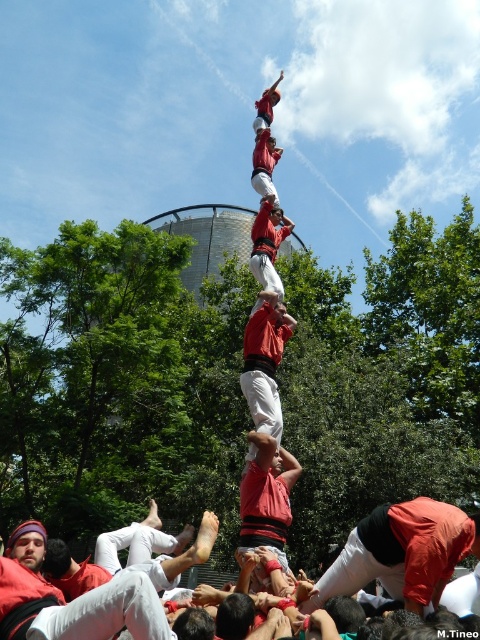
Consider the image. Can you confirm if red fabric shirt at center is thinner than red fabric-clad person at center?

Incorrect, red fabric shirt at center's width is not less than red fabric-clad person at center's.

Can you confirm if red fabric shirt at center is smaller than red fabric-clad person at center?

Actually, red fabric shirt at center might be larger than red fabric-clad person at center.

Who is more distant from viewer, (279,547) or (283,237)?

Positioned behind is point (283,237).

This screenshot has height=640, width=480. In order to click on red fabric shirt at center in this screenshot , I will do `click(266, 497)`.

Is red fabric shirt at center to the right of matte red shirt at center from the viewer's perspective?

No, red fabric shirt at center is not to the right of matte red shirt at center.

The height and width of the screenshot is (640, 480). Describe the element at coordinates (266, 497) in the screenshot. I see `red fabric shirt at center` at that location.

In the scene shown: Measure the distance between point (259, 467) and camera.

153.26 feet

Identify the location of red fabric shirt at center. (266, 497).

Who is taller, red fabric man at lower right or red fabric-clad person at center?

Standing taller between the two is red fabric-clad person at center.

Who is higher up, red fabric man at lower right or red fabric-clad person at center?

red fabric-clad person at center

Which is behind, point (475, 548) or point (264, 250)?

The point (264, 250) is behind.

Locate an element on the screen. red fabric man at lower right is located at coordinates (402, 552).